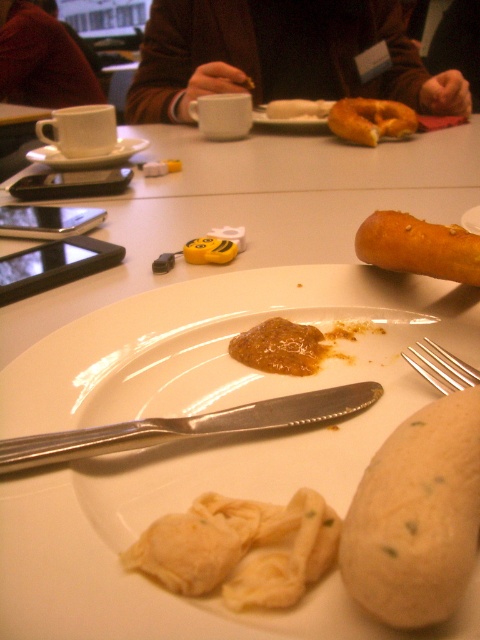
You are setting up a table for a guest and need to place a napkin between the silver metallic knife at center and the silver metallic fork at lower right. Based on their positions, where should you place the napkin?

The silver metallic knife at center is closer to the viewer than the silver metallic fork at lower right, so you should place the napkin between them with the knife side closer to the guest, as it is nearer.

What are the coordinates of the silver metallic knife at center?

The silver metallic knife at center is located at coordinates point (188,426).